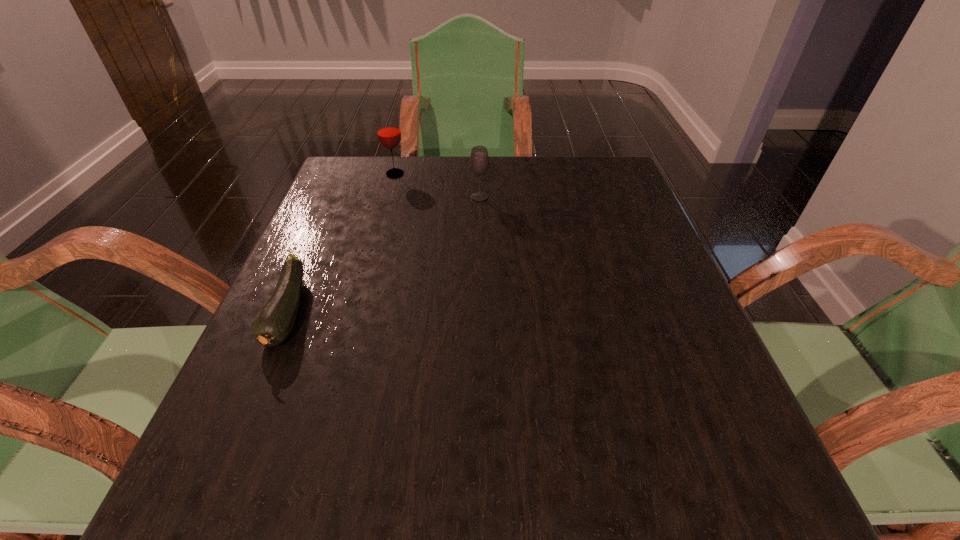
Where is `zucchini at the left edge`? This screenshot has height=540, width=960. zucchini at the left edge is located at coordinates (275, 322).

Locate an element on the screen. The height and width of the screenshot is (540, 960). object at the far left corner is located at coordinates (388, 130).

The width and height of the screenshot is (960, 540). What are the coordinates of `vacant area at the far edge of the desktop` in the screenshot? It's located at (399, 189).

The image size is (960, 540). Identify the location of vacant position at the left edge of the desktop. (348, 324).

Locate an element on the screen. Image resolution: width=960 pixels, height=540 pixels. blank space at the right edge of the desktop is located at coordinates (697, 382).

Identify the location of free space at the near left corner of the desktop. (169, 509).

The image size is (960, 540). Identify the location of free space at the far right corner. (608, 194).

Locate an element on the screen. Image resolution: width=960 pixels, height=540 pixels. vacant space at the near right corner of the desktop is located at coordinates coord(688,477).

Where is `vacant space that's between the rightmost object and the second object from left to right`? Image resolution: width=960 pixels, height=540 pixels. vacant space that's between the rightmost object and the second object from left to right is located at coordinates (437, 185).

The height and width of the screenshot is (540, 960). Identify the location of free space between the tallest object and the shortest object. (342, 243).